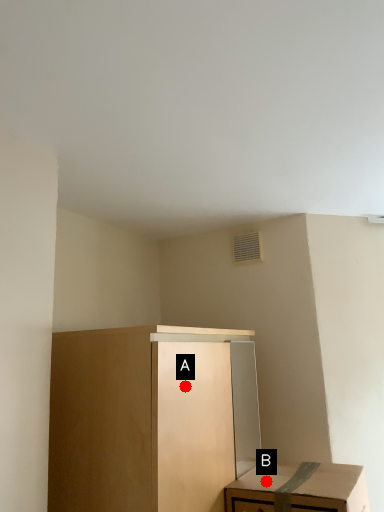
Question: Two points are circled on the image, labeled by A and B beside each circle. Among these points, which one is farthest from the camera?

Choices:
 (A) A is further
 (B) B is further

Answer: (B)